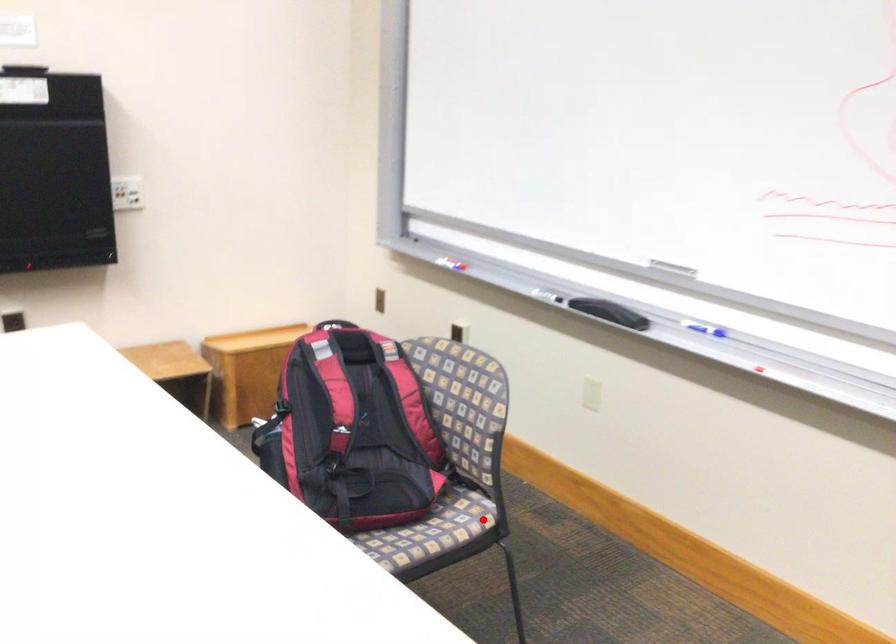
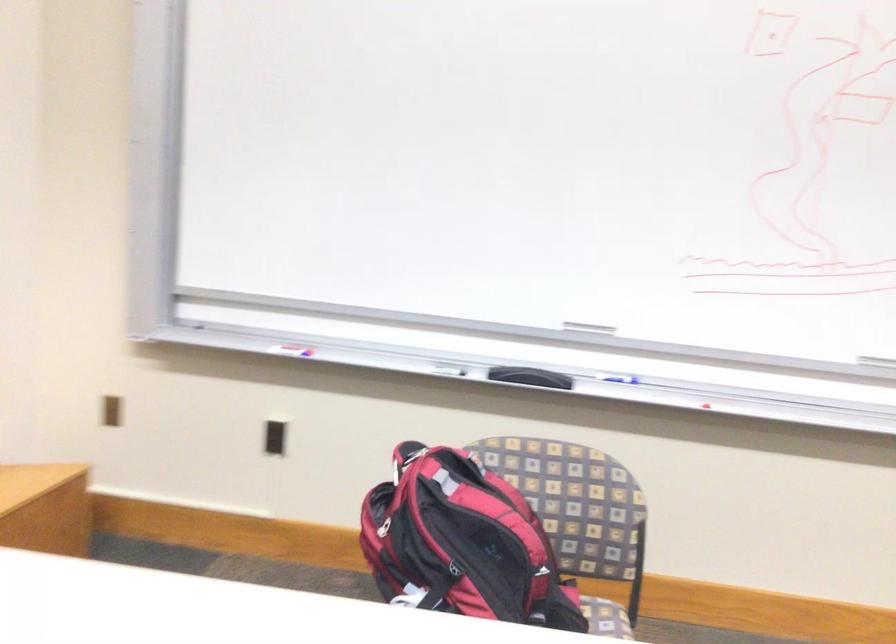
Where in the second image is the point corresponding to the highlighted location from the first image?

(606, 618)